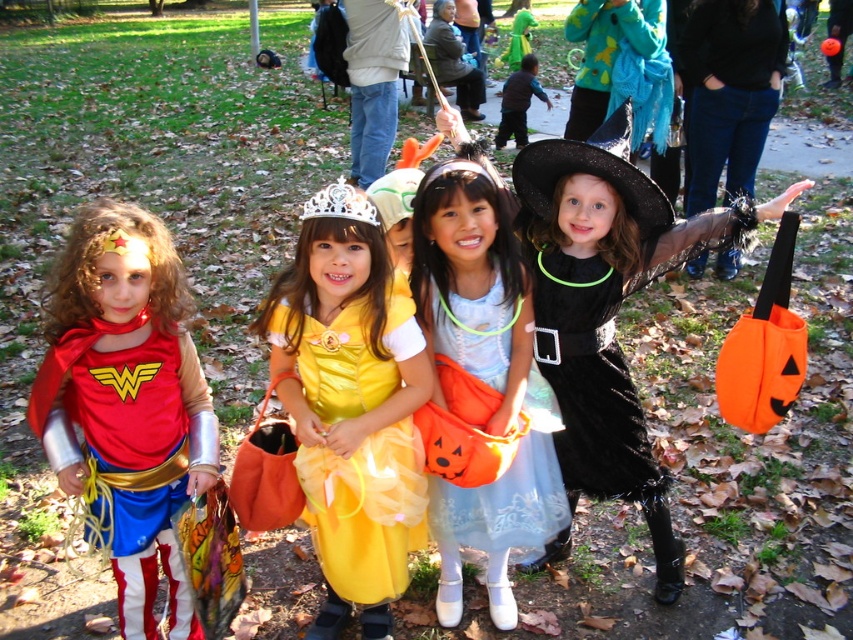
Who is shorter, yellow satin dress at center or light blue satin dress at center?

With less height is light blue satin dress at center.

The width and height of the screenshot is (853, 640). What do you see at coordinates (351, 404) in the screenshot? I see `yellow satin dress at center` at bounding box center [351, 404].

Who is more forward, (396, 586) or (532, 500)?

Positioned in front is point (396, 586).

I want to click on yellow satin dress at center, so click(x=351, y=404).

The width and height of the screenshot is (853, 640). Describe the element at coordinates (126, 403) in the screenshot. I see `matte red cape at left` at that location.

Which of these two, matte red cape at left or black matte witch hat at center, stands shorter?

black matte witch hat at center is shorter.

Who is more forward, (123, 253) or (543, 179)?

Point (123, 253) is more forward.

Identify the location of matte red cape at left. tap(126, 403).

Does matte red cape at left have a greater height compared to yellow satin dress at center?

No, matte red cape at left is not taller than yellow satin dress at center.

Is point (80, 371) farther from viewer compared to point (273, 368)?

No.

Does point (148, 380) lie in front of point (329, 548)?

Yes, point (148, 380) is closer to viewer.

Identify the location of matte red cape at left. The image size is (853, 640). (126, 403).